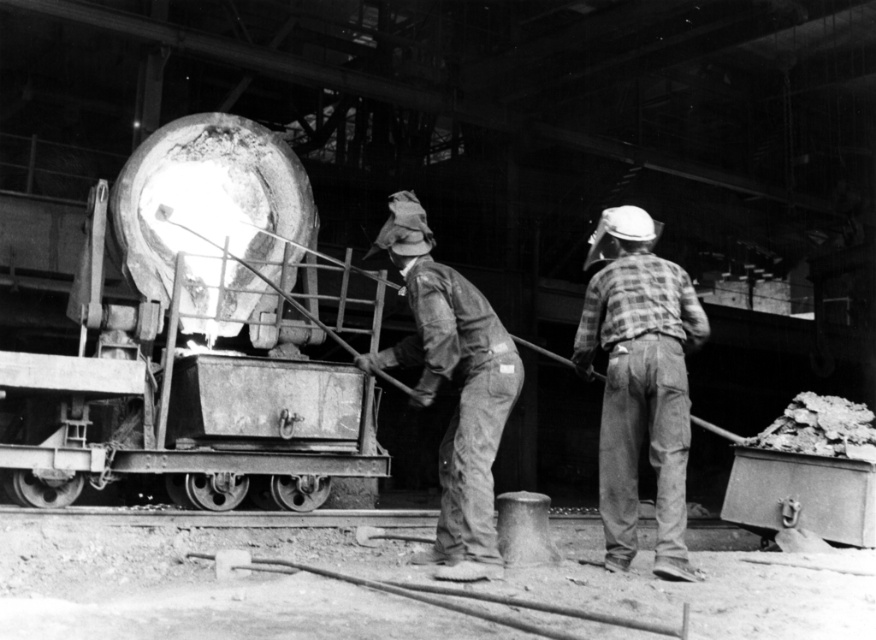
You are an inspector in the facility and need to access the rusty metal shovel at center. However, the plaid fabric shirt at right is blocking your path. Can you reach the shovel without moving the shirt?

The rusty metal shovel at center is behind the plaid fabric shirt at right, so you can reach it without moving the shirt as it is positioned behind.

In the scene shown: You are an inspector in the industrial facility. You need to check the distance between the plaid fabric shirt at right and the rusty metal shovel at center. Is the distance less than 40 inches?

The plaid fabric shirt at right is 37.71 inches from the rusty metal shovel at center, so yes, the distance is less than 40 inches.

You are an inspector in the facility and need to assess the height of the plaid fabric shirt at right and the rusty metal shovel at center. Which object is shorter?

The plaid fabric shirt at right is shorter than the rusty metal shovel at center.